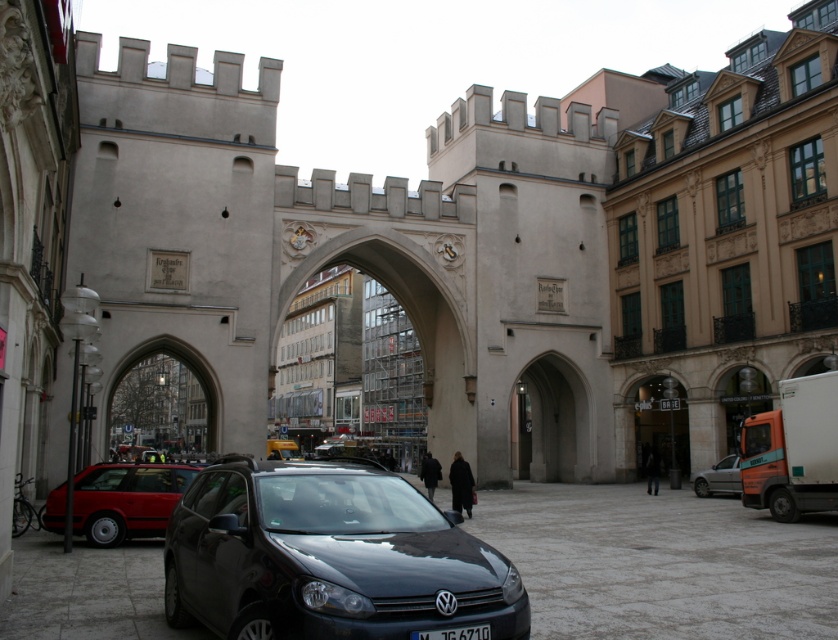
Is point (221, 552) more distant than point (153, 467)?

No, it is in front of (153, 467).

Does shiny black car at center have a greater height compared to shiny red sedan at lower left?

Yes, shiny black car at center is taller than shiny red sedan at lower left.

Measure the distance between shiny black car at center and camera.

The distance of shiny black car at center from camera is 23.17 meters.

Identify the location of shiny black car at center. click(x=329, y=557).

Can you confirm if shiny black car at center is smaller than black plastic license plate at center?

No, shiny black car at center is not smaller than black plastic license plate at center.

Between point (360, 486) and point (489, 634), which one is positioned in front?

Point (489, 634) is in front.

The width and height of the screenshot is (838, 640). I want to click on shiny black car at center, so click(x=329, y=557).

Between shiny black car at center and silver metallic sedan at lower right, which one is positioned lower?

silver metallic sedan at lower right is lower down.

In order to click on shiny black car at center in this screenshot , I will do `click(329, 557)`.